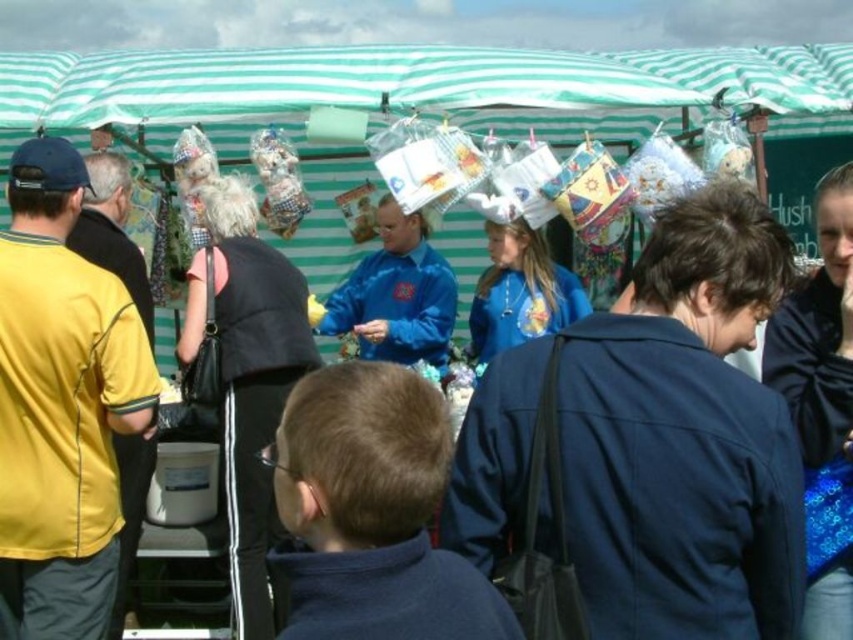
Question: Which object is closer to the camera taking this photo?

Choices:
 (A) yellow fabric shirt at left
 (B) blue matte shirt at center
 (C) dark blue jacket at center

Answer: (C)

Question: Is blue velvet jacket at center wider than blue matte shirt at center?

Choices:
 (A) yes
 (B) no

Answer: (A)

Question: Can you confirm if black fabric at center is wider than blue velvet jacket at center?

Choices:
 (A) yes
 (B) no

Answer: (B)

Question: Which point is farther from the camera taking this photo?

Choices:
 (A) (77, 420)
 (B) (421, 321)
 (C) (229, 433)

Answer: (B)

Question: Is dark blue jacket at center to the left of yellow fabric shirt at left from the viewer's perspective?

Choices:
 (A) no
 (B) yes

Answer: (A)

Question: Among these objects, which one is farthest from the camera?

Choices:
 (A) black fabric at center
 (B) blue velvet jacket at center
 (C) green striped canopy at upper center

Answer: (B)